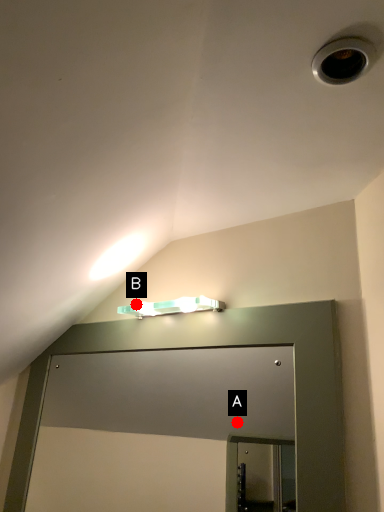
Question: Two points are circled on the image, labeled by A and B beside each circle. Which of the following is the closest to the observer?

Choices:
 (A) A is closer
 (B) B is closer

Answer: (B)